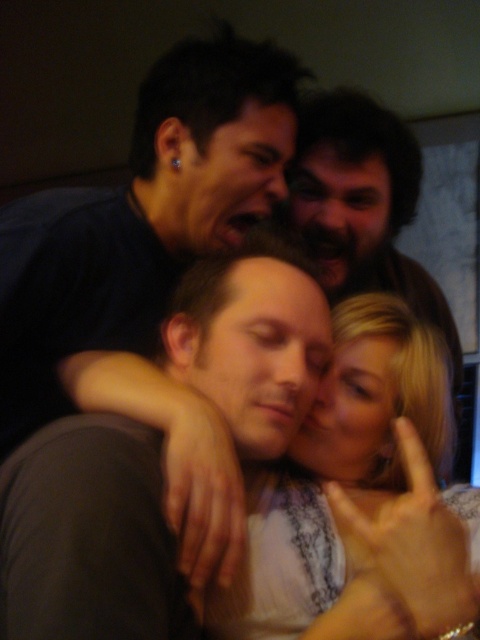
You are taking a photo of two points in the image. The first point is at coordinates point (x=148, y=326) and the second is at point (x=338, y=568). Which point is closer to the camera?

Point (x=148, y=326) is closer to the camera than point (x=338, y=568).

You are standing in the room and want to reach the point marked as point (383, 339). If your arm is 30 inches long, can you reach it without moving your feet?

The point (383, 339) is 34.22 inches away from you, which is further than your 30 inch arm length. You cannot reach it without moving your feet.

You are trying to identify the people in the image. Which of the two, the blonde hair at center or the bearded man at upper center, appears smaller in size?

The blonde hair at center is smaller than the bearded man at upper center.